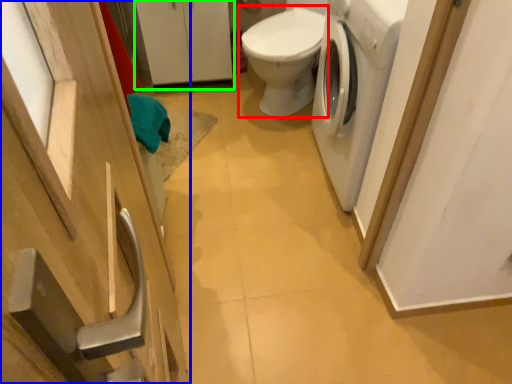
Question: Considering the real-world distances, which object is farthest from toilet (highlighted by a red box)? cabinetry (highlighted by a blue box) or cabinetry (highlighted by a green box)?

Choices:
 (A) cabinetry
 (B) cabinetry

Answer: (A)